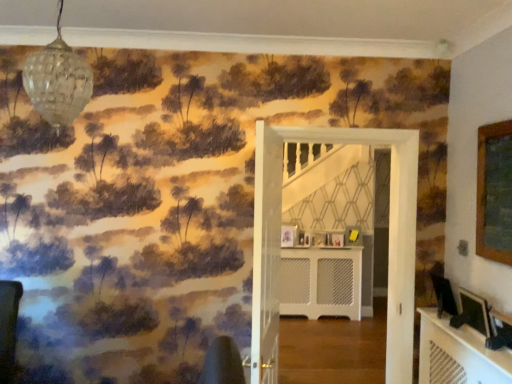
Question: Does wooden picture frame at center, the second picture frame viewed from the back, have a lesser height compared to clear glass globe at upper left?

Choices:
 (A) no
 (B) yes

Answer: (B)

Question: From the image's perspective, is wooden picture frame at center, placed as the fourth picture frame when sorted from front to back, on top of clear glass globe at upper left?

Choices:
 (A) no
 (B) yes

Answer: (A)

Question: Is clear glass globe at upper left surrounded by wooden picture frame at center, the second picture frame viewed from the back?

Choices:
 (A) no
 (B) yes

Answer: (A)

Question: Is wooden picture frame at center, placed as the fourth picture frame when sorted from front to back, thinner than clear glass globe at upper left?

Choices:
 (A) no
 (B) yes

Answer: (B)

Question: Is wooden picture frame at center, placed as the second picture frame when sorted from left to right, oriented away from clear glass globe at upper left?

Choices:
 (A) no
 (B) yes

Answer: (A)

Question: From their relative heights in the image, would you say yellow matte picture frame at center, the 1th picture frame viewed from the back, is taller or shorter than clear glass globe at upper left?

Choices:
 (A) short
 (B) tall

Answer: (A)

Question: Looking at the image, does yellow matte picture frame at center, the 1th picture frame viewed from the back, seem bigger or smaller compared to clear glass globe at upper left?

Choices:
 (A) small
 (B) big

Answer: (A)

Question: Based on their positions, is yellow matte picture frame at center, the 1th picture frame viewed from the back, located to the left or right of clear glass globe at upper left?

Choices:
 (A) left
 (B) right

Answer: (B)

Question: Looking at their shapes, would you say yellow matte picture frame at center, the first picture frame viewed from the right, is wider or thinner than clear glass globe at upper left?

Choices:
 (A) wide
 (B) thin

Answer: (B)

Question: Is matte black picture frame at center, the 5th picture frame in the right-to-left sequence, bigger or smaller than yellow matte picture frame at center, arranged as the 5th picture frame when viewed from the left?

Choices:
 (A) small
 (B) big

Answer: (A)

Question: From their relative heights in the image, would you say matte black picture frame at center, placed as the 2th picture frame when sorted from front to back, is taller or shorter than yellow matte picture frame at center, marked as the fifth picture frame in a front-to-back arrangement?

Choices:
 (A) short
 (B) tall

Answer: (A)

Question: From a real-world perspective, relative to yellow matte picture frame at center, marked as the fifth picture frame in a front-to-back arrangement, is matte black picture frame at center, placed as the 2th picture frame when sorted from front to back, vertically above or below?

Choices:
 (A) above
 (B) below

Answer: (B)

Question: Is point (287, 244) positioned closer to the camera than point (358, 243)?

Choices:
 (A) farther
 (B) closer

Answer: (A)

Question: In terms of size, does matte black picture frame at lower right, the second picture frame in the right-to-left sequence, appear bigger or smaller than white textured radiator at center?

Choices:
 (A) big
 (B) small

Answer: (B)

Question: From a real-world perspective, relative to white textured radiator at center, is matte black picture frame at lower right, the first picture frame positioned from the front, vertically above or below?

Choices:
 (A) above
 (B) below

Answer: (A)